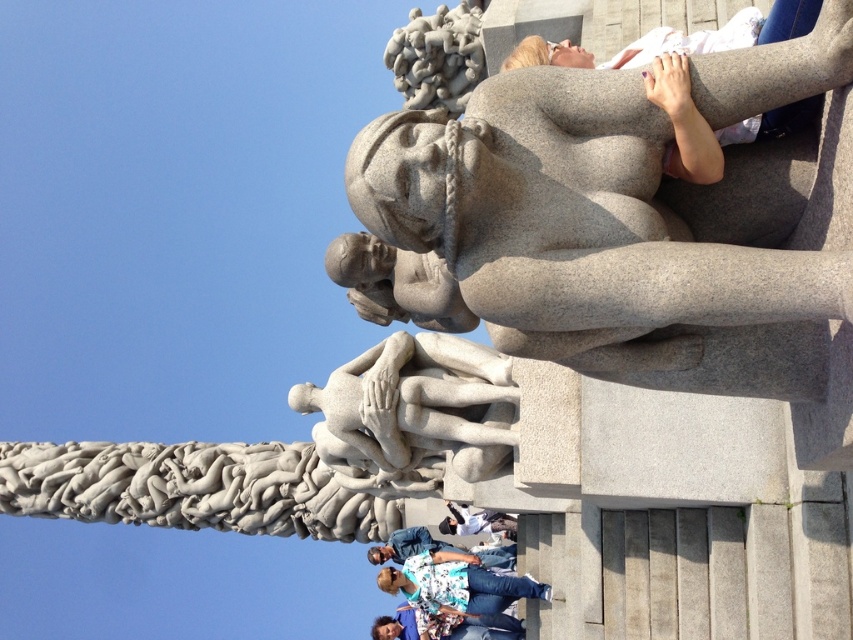
In the scene shown: You are a photographer trying to capture the entire white stone sculpture at center and the white cotton shirt at lower center in one frame. Given that the camera can only focus on objects within a 1.5 meter height range, will both objects be in focus?

The white stone sculpture at center is taller than the white cotton shirt at lower center. Since the camera can focus on objects within a 1.5 meter height range, if the height difference between them is less than 1.5 meters, both will be in focus. However, if the sculpture is significantly taller, exceeding the 1.5 meter range, only part of them might be in focus. The exact answer depends on the actual height difference not provided here.

You are standing in front of the sculpture and want to touch both points on it. Which point should you reach for first, point (379, 381) or point (463, 531)?

You should reach for point (379, 381) first because it is closer to you than point (463, 531).